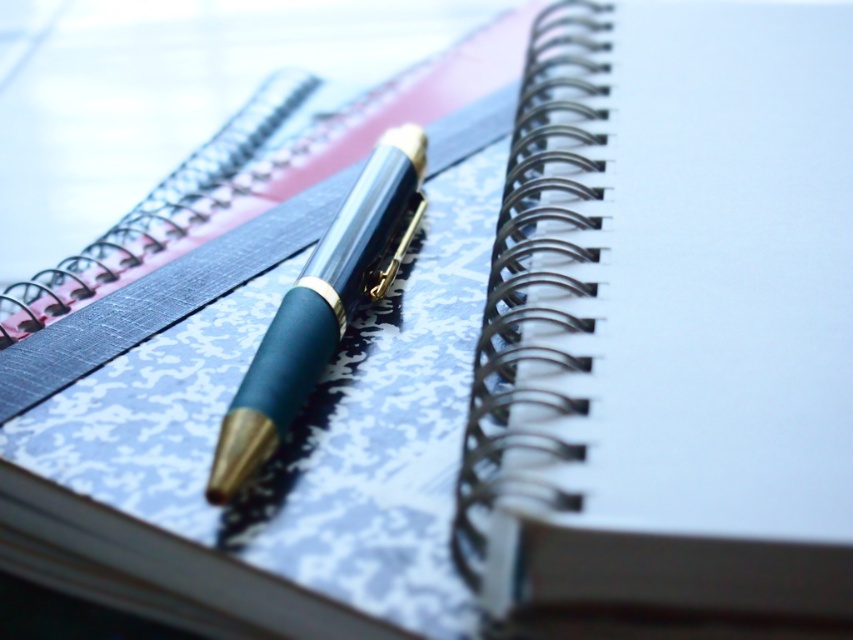
Question: Can you confirm if satin silver journal at upper left is positioned to the right of matte blue pen at center?

Choices:
 (A) no
 (B) yes

Answer: (B)

Question: Does satin silver journal at upper left appear under matte blue pen at center?

Choices:
 (A) yes
 (B) no

Answer: (B)

Question: Can you confirm if satin silver journal at upper left is positioned above matte blue pen at center?

Choices:
 (A) yes
 (B) no

Answer: (A)

Question: Which object appears farthest from the camera in this image?

Choices:
 (A) satin silver journal at upper left
 (B) matte blue pen at center

Answer: (B)